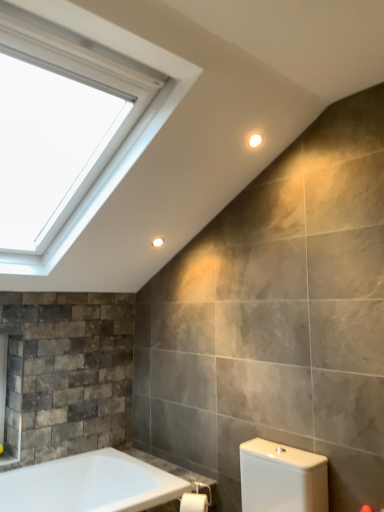
Question: Which direction should I rotate to look at matte white light fixture at upper center, which is the 2th light fixture in back-to-front order?

Choices:
 (A) left
 (B) right

Answer: (B)

Question: From a real-world perspective, is matte white light fixture at upper center, the 1th light fixture viewed from the top, positioned over white glossy bathtub at lower left based on gravity?

Choices:
 (A) no
 (B) yes

Answer: (B)

Question: Does matte white light fixture at upper center, which is the 2th light fixture in back-to-front order, have a smaller size compared to white glossy bathtub at lower left?

Choices:
 (A) no
 (B) yes

Answer: (B)

Question: From a real-world perspective, is matte white light fixture at upper center, arranged as the first light fixture when viewed from the front, under white glossy bathtub at lower left?

Choices:
 (A) no
 (B) yes

Answer: (A)

Question: Does matte white light fixture at upper center, which is the second light fixture from bottom to top, have a lesser width compared to white glossy bathtub at lower left?

Choices:
 (A) yes
 (B) no

Answer: (A)

Question: Is matte white light fixture at upper center, arranged as the first light fixture when viewed from the front, positioned far away from white glossy bathtub at lower left?

Choices:
 (A) yes
 (B) no

Answer: (A)

Question: Does matte white light fixture at upper center, which is the 2th light fixture in back-to-front order, have a larger size compared to white glossy bathtub at lower left?

Choices:
 (A) no
 (B) yes

Answer: (A)

Question: Is white matte toilet paper at lower center not near matte white light fixture at upper center, which is the second light fixture from bottom to top?

Choices:
 (A) no
 (B) yes

Answer: (B)

Question: From a real-world perspective, is white matte toilet paper at lower center located higher than matte white light fixture at upper center, which is the 2th light fixture in back-to-front order?

Choices:
 (A) no
 (B) yes

Answer: (A)

Question: Is the position of white matte toilet paper at lower center less distant than that of matte white light fixture at upper center, the 1th light fixture viewed from the top?

Choices:
 (A) no
 (B) yes

Answer: (B)

Question: Is white matte toilet paper at lower center oriented towards matte white light fixture at upper center, which is the second light fixture from bottom to top?

Choices:
 (A) no
 (B) yes

Answer: (A)

Question: Is white matte toilet paper at lower center surrounding matte white light fixture at upper center, arranged as the first light fixture when viewed from the front?

Choices:
 (A) yes
 (B) no

Answer: (B)

Question: Does white matte toilet paper at lower center have a larger size compared to matte white light fixture at upper center, arranged as the first light fixture when viewed from the front?

Choices:
 (A) yes
 (B) no

Answer: (A)

Question: From a real-world perspective, is white glossy bathtub at lower left located higher than matte white light fixture at upper center, positioned as the 2th light fixture in right-to-left order?

Choices:
 (A) no
 (B) yes

Answer: (A)